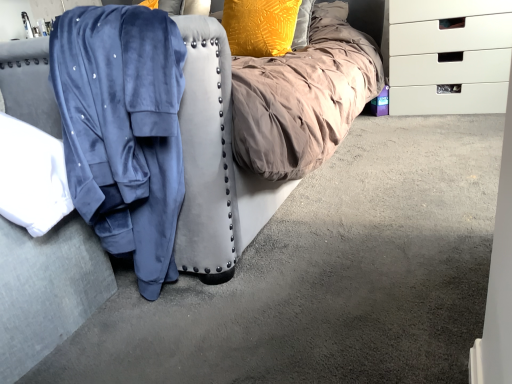
Question: Is velvet blue robe at left positioned before velvet blue robe at left?

Choices:
 (A) no
 (B) yes

Answer: (B)

Question: Does velvet blue robe at left have a greater height compared to velvet blue robe at left?

Choices:
 (A) no
 (B) yes

Answer: (A)

Question: Does velvet blue robe at left lie behind velvet blue robe at left?

Choices:
 (A) no
 (B) yes

Answer: (A)

Question: Is velvet blue robe at left not near velvet blue robe at left?

Choices:
 (A) yes
 (B) no

Answer: (B)

Question: Considering the relative positions of velvet blue robe at left and velvet blue robe at left in the image provided, is velvet blue robe at left to the left of velvet blue robe at left from the viewer's perspective?

Choices:
 (A) no
 (B) yes

Answer: (A)

Question: Can we say velvet blue robe at left lies outside velvet blue robe at left?

Choices:
 (A) no
 (B) yes

Answer: (B)

Question: Could you tell me if textured yellow pillow at upper center is facing velvet blue robe at left?

Choices:
 (A) no
 (B) yes

Answer: (A)

Question: Is textured yellow pillow at upper center outside velvet blue robe at left?

Choices:
 (A) yes
 (B) no

Answer: (A)

Question: Is textured yellow pillow at upper center to the left of velvet blue robe at left from the viewer's perspective?

Choices:
 (A) no
 (B) yes

Answer: (B)

Question: Are textured yellow pillow at upper center and velvet blue robe at left far apart?

Choices:
 (A) no
 (B) yes

Answer: (B)

Question: From the image's perspective, is textured yellow pillow at upper center located beneath velvet blue robe at left?

Choices:
 (A) yes
 (B) no

Answer: (B)

Question: Can you confirm if textured yellow pillow at upper center is smaller than velvet blue robe at left?

Choices:
 (A) no
 (B) yes

Answer: (B)

Question: From a real-world perspective, does white plastic chest of drawers at right sit lower than textured yellow pillow at upper center?

Choices:
 (A) yes
 (B) no

Answer: (A)